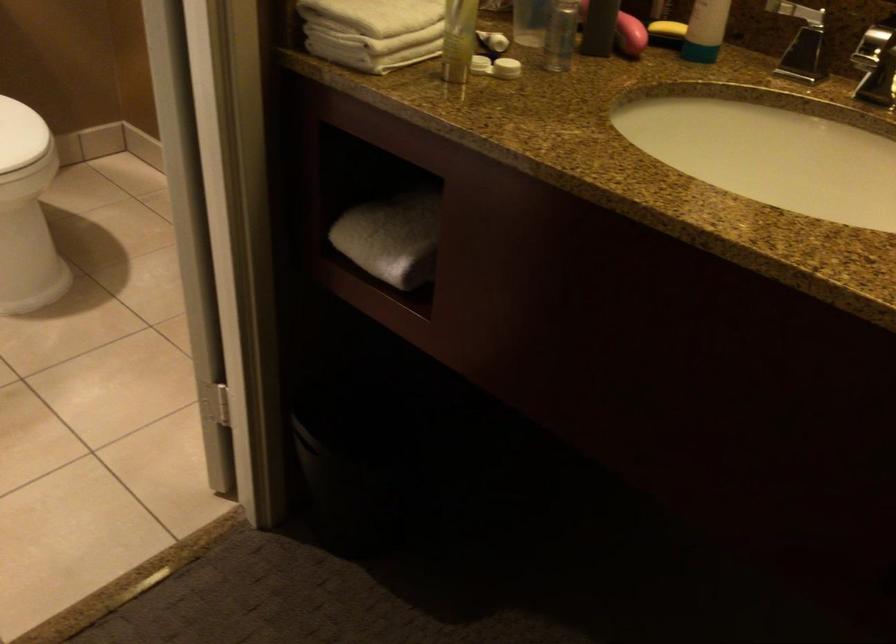
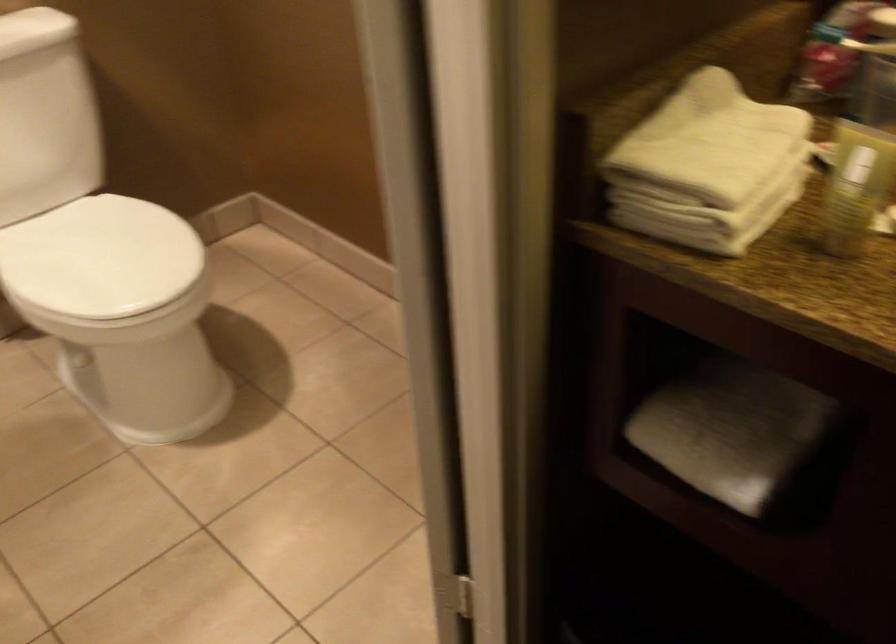
Where in the second image is the point corresponding to [394,230] from the first image?

(730, 431)